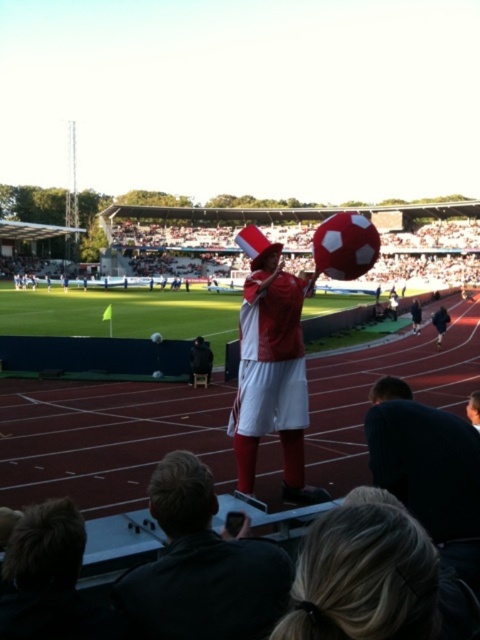
Question: Estimate the real-world distances between objects in this image. Which object is closer to the dark blue fabric jacket at center?

Choices:
 (A) matte red hat at center
 (B) matte black jacket at center

Answer: (A)

Question: Which object is closer to the camera taking this photo?

Choices:
 (A) matte red hat at center
 (B) matte black jacket at center

Answer: (B)

Question: Can you confirm if matte red hat at center is thinner than dark blue fabric jacket at center?

Choices:
 (A) yes
 (B) no

Answer: (A)

Question: Where is matte red hat at center located in relation to dark blue fabric jacket at center in the image?

Choices:
 (A) above
 (B) below

Answer: (B)

Question: Which object appears farthest from the camera in this image?

Choices:
 (A) matte black jacket at center
 (B) matte red hat at center
 (C) dark blue fabric jacket at center

Answer: (C)

Question: Can you confirm if matte black jacket at center is positioned to the right of matte red hat at center?

Choices:
 (A) yes
 (B) no

Answer: (A)